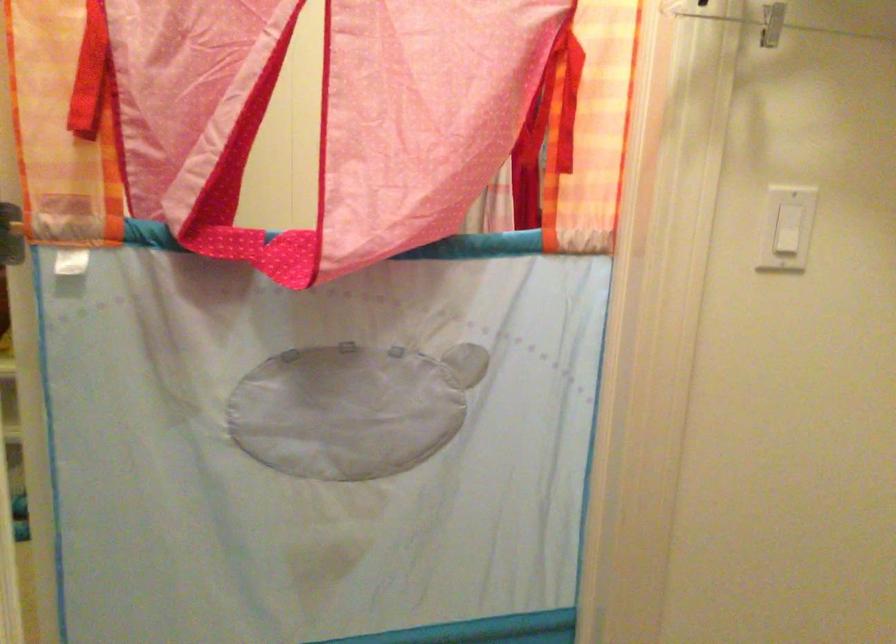
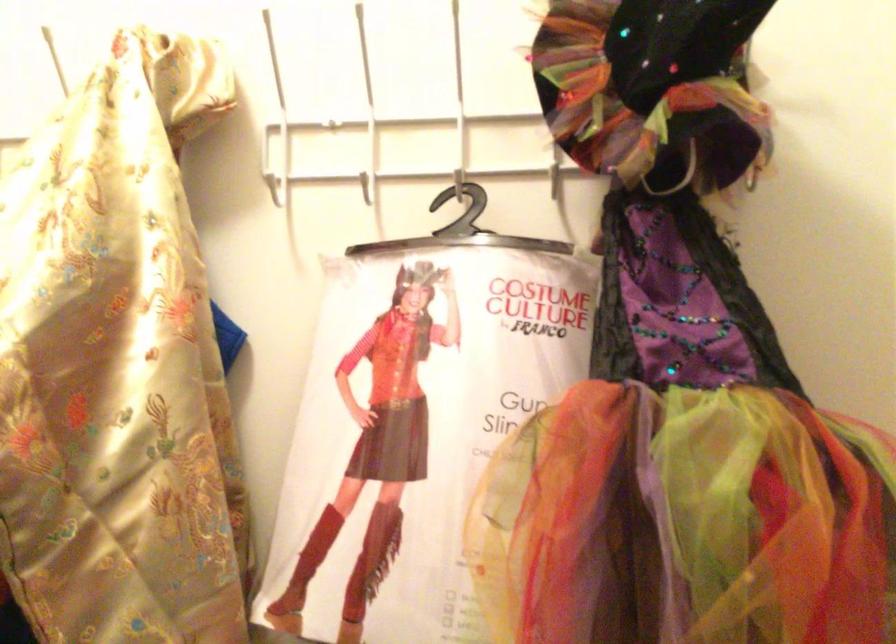
Question: The camera is either moving clockwise (left) or counter-clockwise (right) around the object. The first image is from the beginning of the video and the second image is from the end. Is the camera moving left or right when shooting the video?

Choices:
 (A) Left
 (B) Right

Answer: (B)